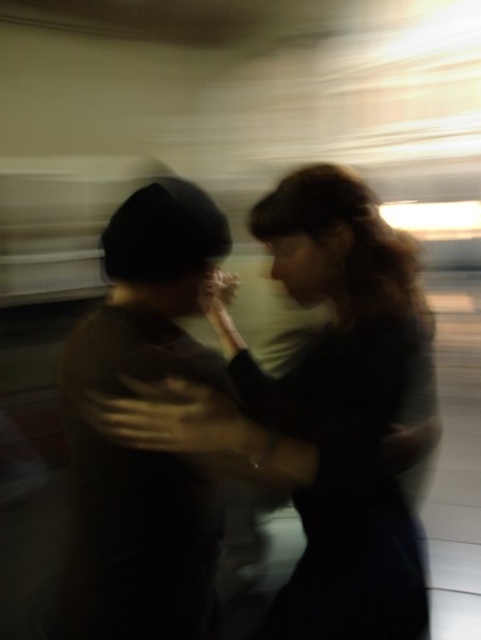
You are a photographer trying to capture a clear shot of the dark brown fabric at center and the dark brown knit hat at left. The camera requires at least 8 inches of distance between the two subjects to focus properly. Based on the scene description, will the camera be able to focus on both subjects?

The dark brown fabric at center is only 7.54 inches from the dark brown knit hat at left, which is less than the required 8 inches. Therefore, the camera may struggle to focus on both subjects due to insufficient distance between them.

You are a photographer trying to focus on two points in the image. You notice that point [340,339] and point [157,531] are important. Which point is closer to your camera?

Point [340,339] is further to the camera than point [157,531], so point [340,339] is closer to the camera.